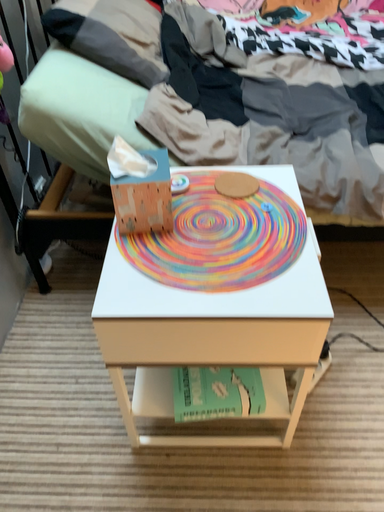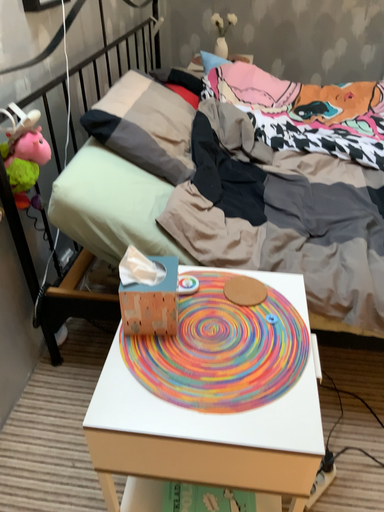
Question: How did the camera likely rotate when shooting the video?

Choices:
 (A) rotated downward
 (B) rotated upward

Answer: (B)